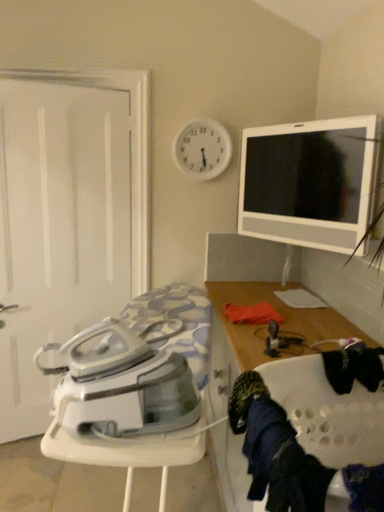
You are a GUI agent. You are given a task and a screenshot of the screen. Output one action in this format:
    pyautogui.click(x=<x>, y=<y>)
    Task: Click on the wooden cabinet at right
    The width and height of the screenshot is (384, 512).
    Given the screenshot: What is the action you would take?
    pyautogui.click(x=285, y=314)

What do you see at coordinates (122, 383) in the screenshot?
I see `white glossy ironing board at lower left` at bounding box center [122, 383].

What is the approximate width of dark blue fabric at lower right?

dark blue fabric at lower right is 4.10 inches in width.

What are the coordinates of `wooden cabinet at right` in the screenshot? It's located at (285, 314).

Is wooden cabinet at right to the left of white matte door at left from the viewer's perspective?

No, wooden cabinet at right is not to the left of white matte door at left.

Can you confirm if wooden cabinet at right is smaller than white matte door at left?

No, wooden cabinet at right is not smaller than white matte door at left.

Could you tell me if wooden cabinet at right is turned towards white matte door at left?

No, wooden cabinet at right is not oriented towards white matte door at left.

Which object is further away from the camera, wooden cabinet at right or white matte door at left?

white matte door at left.

How many degrees apart are the facing directions of white matte door at left and white glossy ironing board at lower left?

The facing directions of white matte door at left and white glossy ironing board at lower left are 95.5 degrees apart.

Between white matte door at left and white glossy ironing board at lower left, which one has more height?

Standing taller between the two is white matte door at left.

Where is `screen door that is on the left side of white glossy ironing board at lower left`? The height and width of the screenshot is (512, 384). screen door that is on the left side of white glossy ironing board at lower left is located at coordinates (66, 219).

Is white glossy ironing board at lower left a part of white matte door at left?

No, white glossy ironing board at lower left is not surrounded by white matte door at left.

Does white plastic clock at upper center have a lesser width compared to dark blue fabric at lower right?

Yes, white plastic clock at upper center is thinner than dark blue fabric at lower right.

From the image's perspective, is white plastic clock at upper center positioned above or below dark blue fabric at lower right?

From the image's perspective, white plastic clock at upper center appears above dark blue fabric at lower right.

Is white plastic clock at upper center situated inside dark blue fabric at lower right or outside?

white plastic clock at upper center cannot be found inside dark blue fabric at lower right.

Is point (279, 142) closer to camera compared to point (120, 287)?

Yes, it is.

Is there a large distance between white glossy tv at upper right and white matte door at left?

No, there isn't a large distance between white glossy tv at upper right and white matte door at left.

Image resolution: width=384 pixels, height=512 pixels. In the image, there is a white matte door at left. Identify the location of tableware above it (from the image's perspective). (311, 181).

From the image's perspective, which one is positioned higher, white glossy tv at upper right or white matte door at left?

From the image's view, white glossy tv at upper right is above.

The width and height of the screenshot is (384, 512). In the image, there is a white glossy tv at upper right. In order to click on clothing below it (from the image's perspective) in this screenshot , I will do 275,451.

Looking at this image, which object is positioned more to the right, white glossy tv at upper right or dark blue fabric at lower right?

white glossy tv at upper right is more to the right.

Is white glossy tv at upper right oriented towards dark blue fabric at lower right?

Yes, white glossy tv at upper right is facing dark blue fabric at lower right.

Looking at this image, are white glossy tv at upper right and dark blue fabric at lower right located far from each other?

Yes, white glossy tv at upper right and dark blue fabric at lower right are quite far apart.

Is the depth of dark blue fabric at lower right less than that of white glossy tv at upper right?

Yes, it is in front of white glossy tv at upper right.

At what (x,y) coordinates should I click in order to perform the action: click on clothing that appears in front of the white glossy tv at upper right. Please return your answer as a coordinate pair (x, y). Looking at the image, I should click on (275, 451).

Is dark blue fabric at lower right smaller than white glossy tv at upper right?

Yes, dark blue fabric at lower right is smaller than white glossy tv at upper right.

Which is more to the left, dark blue fabric at lower right or white glossy tv at upper right?

Positioned to the left is dark blue fabric at lower right.

In the scene shown: Which object is positioned more to the left, white glossy ironing board at lower left or white glossy tv at upper right?

white glossy ironing board at lower left.

Is white glossy ironing board at lower left shorter than white glossy tv at upper right?

Yes.

From a real-world perspective, which is physically below, white glossy ironing board at lower left or white glossy tv at upper right?

white glossy ironing board at lower left, from a real-world perspective.

Where is `screen door above the wooden cabinet at right (from a real-world perspective)`? screen door above the wooden cabinet at right (from a real-world perspective) is located at coordinates (66, 219).

Identify the location of screen door to the left of white glossy ironing board at lower left. The image size is (384, 512). (66, 219).

Based on their spatial positions, is dark blue fabric at lower right or white glossy ironing board at lower left closer to white plastic clock at upper center?

The object closer to white plastic clock at upper center is white glossy ironing board at lower left.

Estimate the real-world distances between objects in this image. Which object is further from white plastic clock at upper center, white matte door at left or white glossy tv at upper right?

The object further to white plastic clock at upper center is white matte door at left.

From the image, which object appears to be nearer to white glossy ironing board at lower left, white glossy tv at upper right or dark blue fabric at lower right?

dark blue fabric at lower right is positioned closer to the anchor white glossy ironing board at lower left.

Estimate the real-world distances between objects in this image. Which object is further from white matte door at left, white glossy tv at upper right or dark blue fabric at lower right?

dark blue fabric at lower right lies further to white matte door at left than the other object.

Considering their positions, is white matte door at left positioned further to wooden cabinet at right than white glossy ironing board at lower left?

white matte door at left lies further to wooden cabinet at right than the other object.

Considering their positions, is white matte door at left positioned further to dark blue fabric at lower right than white plastic clock at upper center?

Among the two, white matte door at left is located further to dark blue fabric at lower right.

Considering their positions, is dark blue fabric at lower right positioned closer to white plastic clock at upper center than white matte door at left?

Among the two, white matte door at left is located nearer to white plastic clock at upper center.

When comparing their distances from white glossy tv at upper right, does white glossy ironing board at lower left or dark blue fabric at lower right seem closer?

white glossy ironing board at lower left.

This screenshot has height=512, width=384. Identify the location of tableware between white plastic clock at upper center and wooden cabinet at right in the up-down direction. (311, 181).

Locate an element on the screen. The image size is (384, 512). screen door positioned between white glossy ironing board at lower left and white plastic clock at upper center from near to far is located at coordinates (66, 219).

This screenshot has width=384, height=512. Find the location of `cabinetry located between dark blue fabric at lower right and white plastic clock at upper center in the depth direction`. cabinetry located between dark blue fabric at lower right and white plastic clock at upper center in the depth direction is located at coordinates (285, 314).

This screenshot has width=384, height=512. I want to click on home appliance between dark blue fabric at lower right and white matte door at left along the z-axis, so click(122, 383).